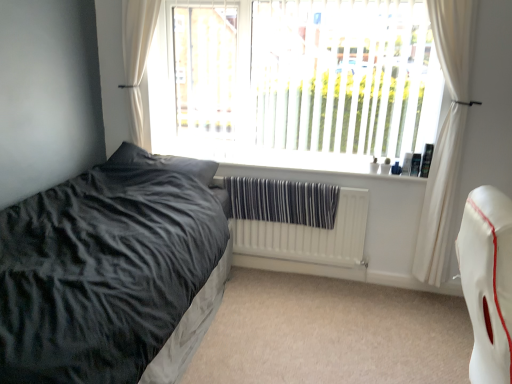
The image size is (512, 384). In order to click on vacant space underneath white plastic window at upper center (from a real-world perspective) in this screenshot , I will do `click(292, 164)`.